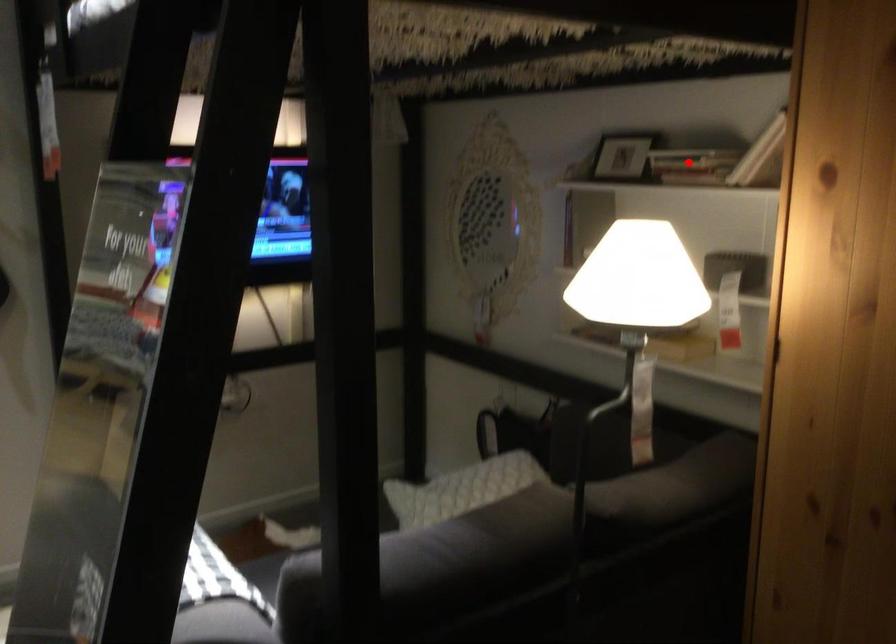
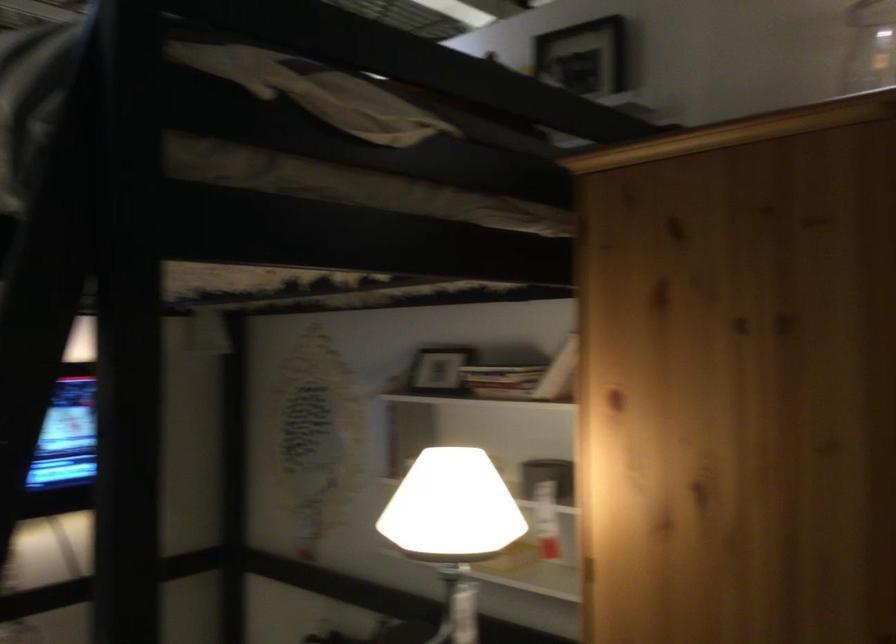
Where in the second image is the point corresponding to the highlighted location from the first image?

(501, 379)